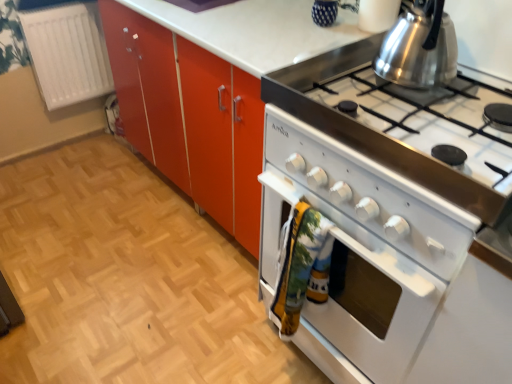
Image resolution: width=512 pixels, height=384 pixels. I want to click on free area below white plastic radiator at left (from a real-world perspective), so click(x=84, y=141).